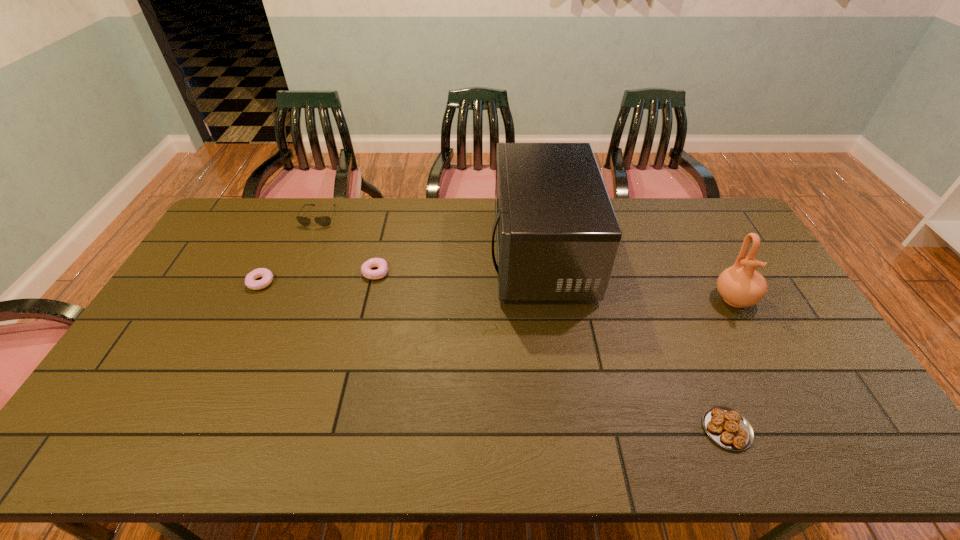
Find the location of a particular element. Image resolution: width=960 pixels, height=540 pixels. vacant point located on the front-facing side of the tallest object is located at coordinates (409, 253).

Image resolution: width=960 pixels, height=540 pixels. In order to click on vacant space located 0.120m on the front-facing side of the tallest object in this screenshot , I will do `click(455, 253)`.

I want to click on free spot located on the spout of the rightmost object, so click(x=812, y=441).

I want to click on vacant space located on the front-facing side of the third tallest object, so coord(281,308).

Identify the location of free space located 0.110m on the back of the right doughnut. This screenshot has width=960, height=540. (383, 242).

What are the coordinates of `free space located on the right of the left doughnut` in the screenshot? It's located at (296, 282).

You are a GUI agent. You are given a task and a screenshot of the screen. Output one action in this format:
    pyautogui.click(x=<x>, y=<y>)
    Task: Click on the vacant space situated 0.220m on the back of the nearest object
    Image resolution: width=960 pixels, height=540 pixels.
    Given the screenshot: What is the action you would take?
    pyautogui.click(x=688, y=337)

Where is `microwave oven situated at the far edge`? microwave oven situated at the far edge is located at coordinates (557, 235).

Image resolution: width=960 pixels, height=540 pixels. What are the coordinates of `sunglasses located in the far edge section of the desktop` in the screenshot? It's located at (324, 221).

This screenshot has height=540, width=960. What are the coordinates of `object present at the near edge` in the screenshot? It's located at (728, 428).